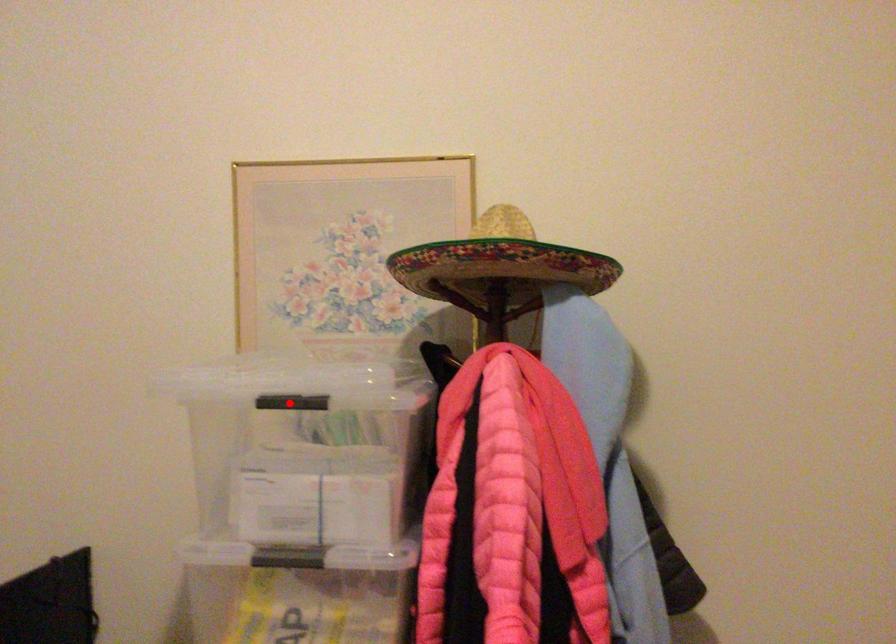
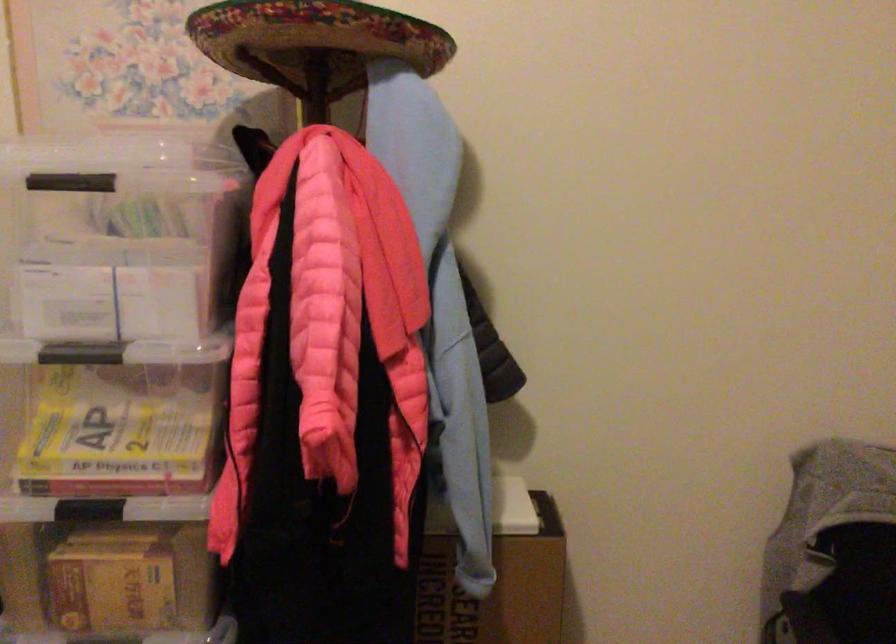
Question: I am providing you with two images of the same scene from different viewpoints. Image1 has a red point marked. In image2, the corresponding 3D location appears at what relative position? Reply with the corresponding letter.

Choices:
 (A) Closer
 (B) Farther

Answer: (A)